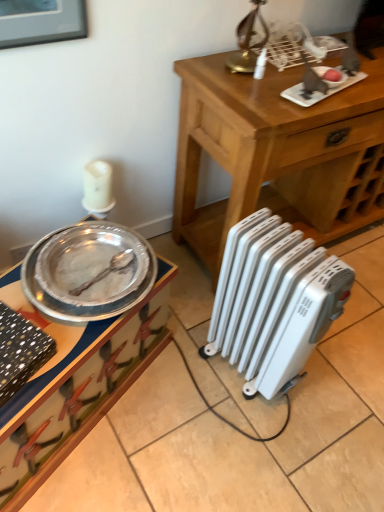
This screenshot has height=512, width=384. In order to click on blank space situated above metallic silver tray at left (from a real-world perspective) in this screenshot , I will do `click(77, 298)`.